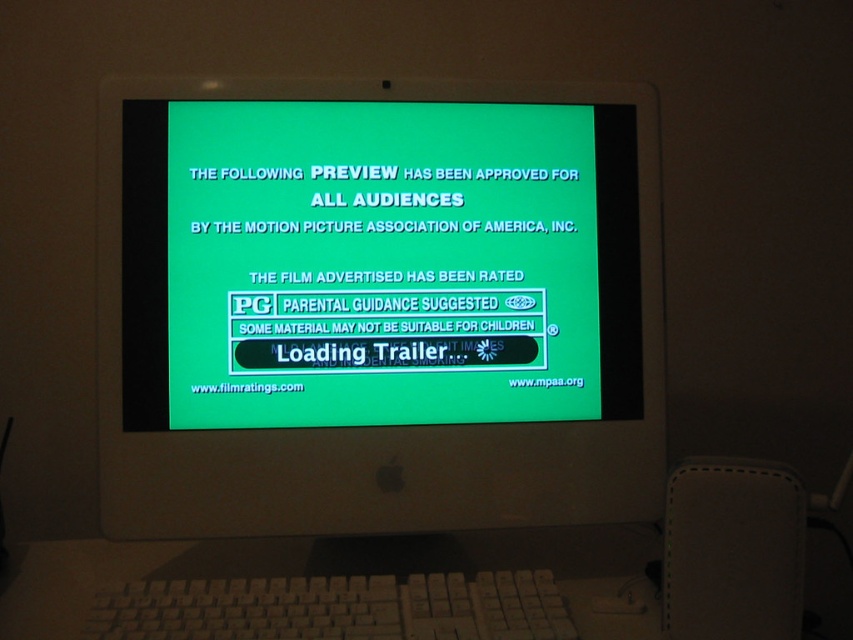
Question: Considering the relative positions of white plastic monitor at center and white plastic keyboard at lower center in the image provided, where is white plastic monitor at center located with respect to white plastic keyboard at lower center?

Choices:
 (A) below
 (B) above

Answer: (B)

Question: Which point appears closest to the camera in this image?

Choices:
 (A) (155, 596)
 (B) (318, 96)

Answer: (A)

Question: Which object appears closest to the camera in this image?

Choices:
 (A) white plastic monitor at center
 (B) white plastic keyboard at lower center

Answer: (B)

Question: Is white plastic monitor at center wider than white plastic keyboard at lower center?

Choices:
 (A) yes
 (B) no

Answer: (A)

Question: Does white plastic monitor at center have a smaller size compared to white plastic keyboard at lower center?

Choices:
 (A) yes
 (B) no

Answer: (B)